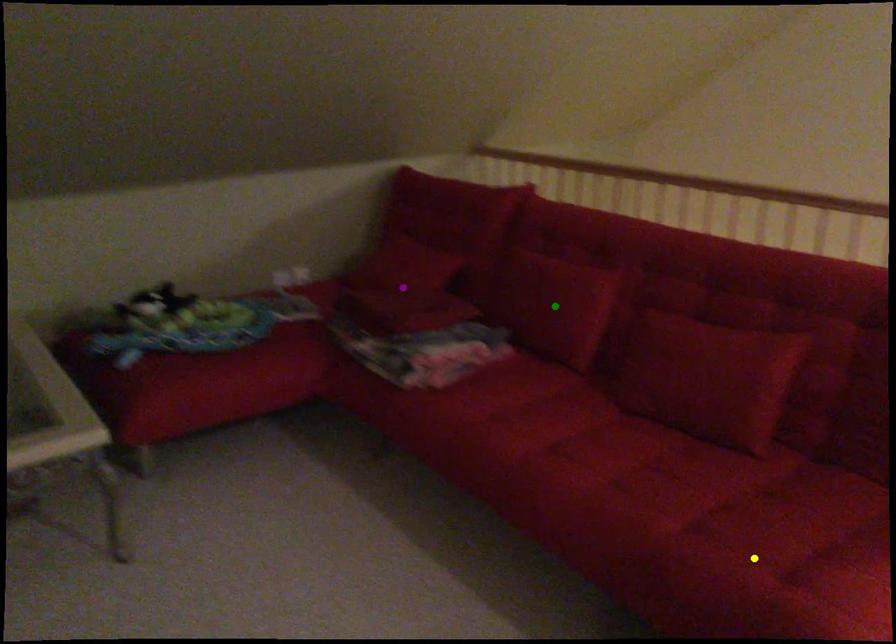
Order these from farthest to nearest:
purple point
yellow point
green point

purple point → green point → yellow point